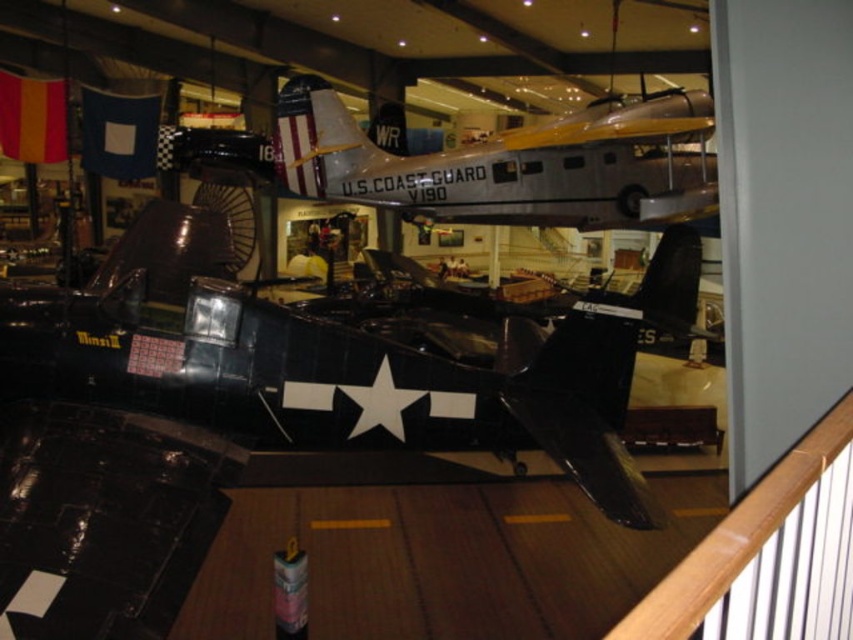
Is point (38, 324) less distant than point (602, 148)?

That is True.

Between shiny black airplane at center and silver metallic airplane at center, which one is positioned lower?

shiny black airplane at center is below.

Where is `shiny black airplane at center`? shiny black airplane at center is located at coordinates (357, 358).